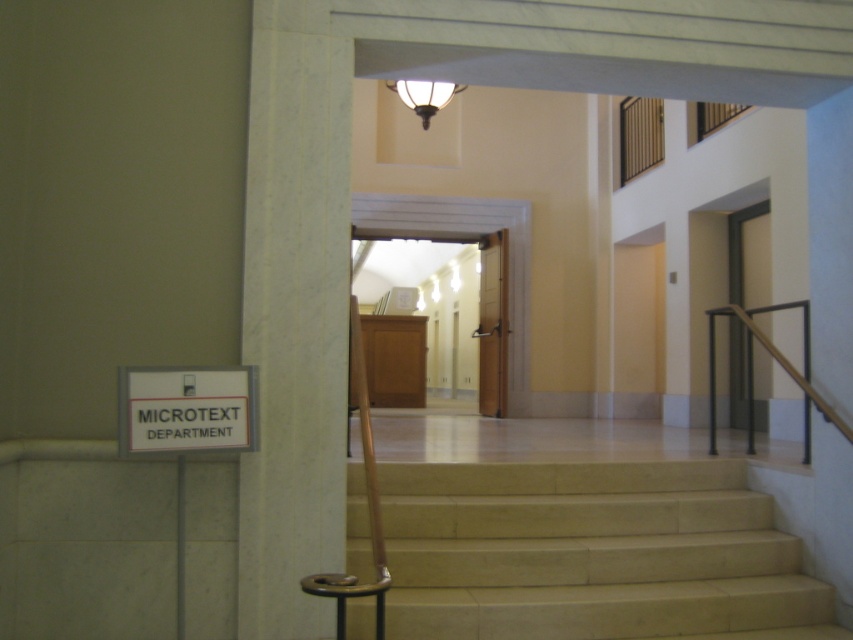
You are standing in the building and want to reach the second floor. According to the image, where are the beige marble stairs at center located?

The beige marble stairs at center are located at point (593, 554) in the image.

You are a visitor in this building and need to find the Microtext Department. You see the beige marble stairs at center and the white plastic sign at lower left. Which object is located higher up in the image?

The white plastic sign at lower left is located higher up in the image because the beige marble stairs at center is positioned under it.